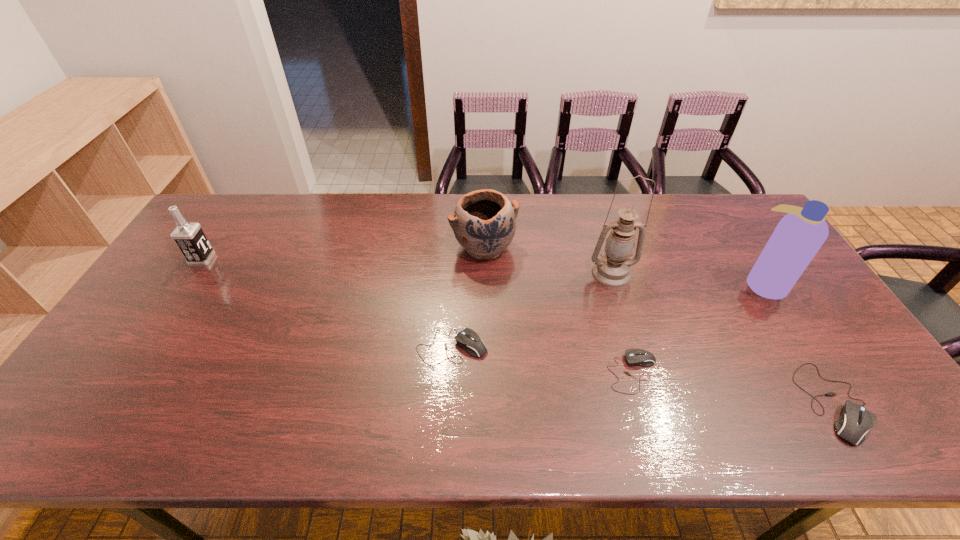
Where is `the sixth tallest object`? the sixth tallest object is located at coordinates (468, 339).

Locate an element on the screen. The height and width of the screenshot is (540, 960). the leftmost computer mouse is located at coordinates coord(468,339).

Image resolution: width=960 pixels, height=540 pixels. Find the location of `the shortest computer mouse`. the shortest computer mouse is located at coordinates (635, 357).

I want to click on the second computer mouse from left to right, so click(x=635, y=357).

Where is `the rightmost computer mouse`? This screenshot has width=960, height=540. the rightmost computer mouse is located at coordinates (855, 420).

Image resolution: width=960 pixels, height=540 pixels. In order to click on pottery in this screenshot , I will do `click(483, 223)`.

The height and width of the screenshot is (540, 960). Identify the location of oil lamp. (613, 270).

Where is `vodka`? vodka is located at coordinates (189, 237).

At what (x,y) coordinates should I click in order to perform the action: click on shampoo. Please return your answer as a coordinate pair (x, y). The width and height of the screenshot is (960, 540). Looking at the image, I should click on (799, 235).

The width and height of the screenshot is (960, 540). I want to click on free location located on the right of the second shortest object, so click(x=557, y=347).